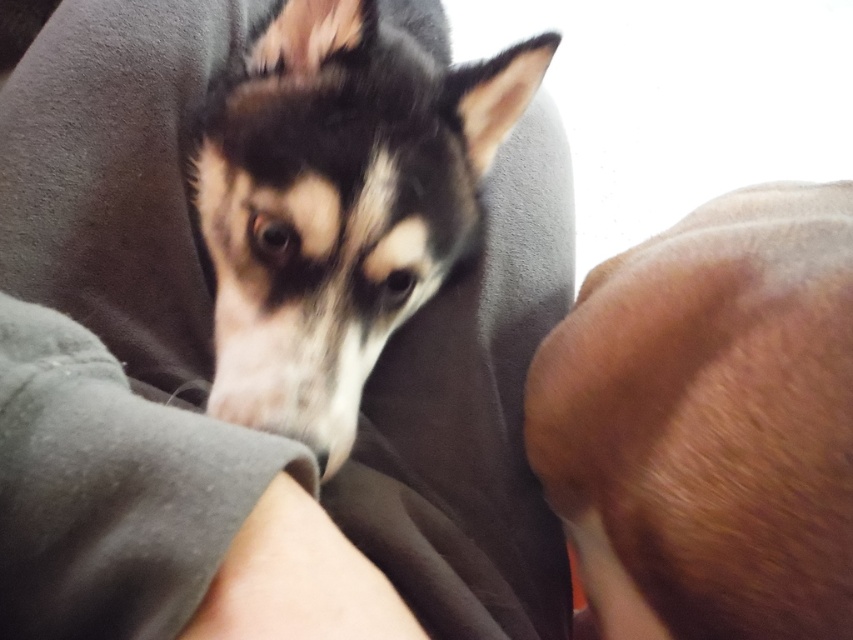
Which of these two, brown fur at lower right or black fur dog at center, stands taller?

Standing taller between the two is black fur dog at center.

Is point (682, 262) closer to camera compared to point (428, 150)?

Yes.

You are a GUI agent. You are given a task and a screenshot of the screen. Output one action in this format:
    pyautogui.click(x=<x>, y=<y>)
    Task: Click on the brown fur at lower right
    The image size is (853, 640).
    Given the screenshot: What is the action you would take?
    pyautogui.click(x=709, y=422)